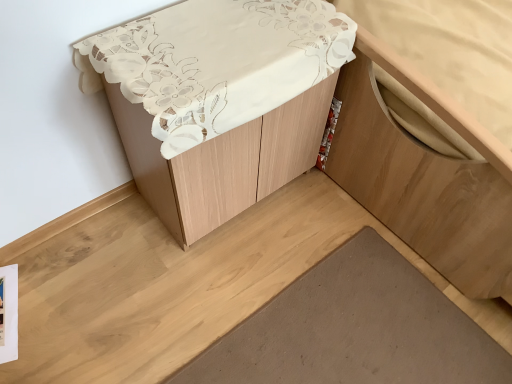
This screenshot has width=512, height=384. I want to click on free space on the front side of matte white cabinet at center, so click(x=192, y=289).